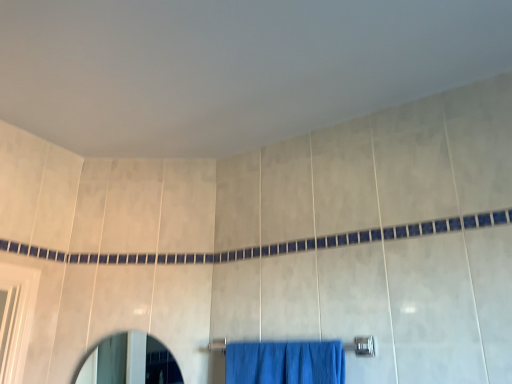
Question: Does matte glass mirror at lower left lie in front of silver metallic towel bar at lower center?

Choices:
 (A) yes
 (B) no

Answer: (B)

Question: Is matte glass mirror at lower left placed right next to silver metallic towel bar at lower center?

Choices:
 (A) no
 (B) yes

Answer: (A)

Question: From the image's perspective, is matte glass mirror at lower left beneath silver metallic towel bar at lower center?

Choices:
 (A) yes
 (B) no

Answer: (A)

Question: Is matte glass mirror at lower left bigger than silver metallic towel bar at lower center?

Choices:
 (A) no
 (B) yes

Answer: (B)

Question: Is matte glass mirror at lower left far away from silver metallic towel bar at lower center?

Choices:
 (A) yes
 (B) no

Answer: (A)

Question: Considering the relative sizes of matte glass mirror at lower left and silver metallic towel bar at lower center in the image provided, is matte glass mirror at lower left thinner than silver metallic towel bar at lower center?

Choices:
 (A) yes
 (B) no

Answer: (A)

Question: Is silver metallic towel bar at lower center positioned far away from matte glass mirror at lower left?

Choices:
 (A) no
 (B) yes

Answer: (B)

Question: Is silver metallic towel bar at lower center at the right side of matte glass mirror at lower left?

Choices:
 (A) yes
 (B) no

Answer: (A)

Question: Does silver metallic towel bar at lower center have a greater width compared to matte glass mirror at lower left?

Choices:
 (A) no
 (B) yes

Answer: (B)

Question: From the image's perspective, is silver metallic towel bar at lower center on matte glass mirror at lower left?

Choices:
 (A) yes
 (B) no

Answer: (A)

Question: Is matte glass mirror at lower left inside silver metallic towel bar at lower center?

Choices:
 (A) yes
 (B) no

Answer: (B)

Question: From a real-world perspective, is silver metallic towel bar at lower center on matte glass mirror at lower left?

Choices:
 (A) yes
 (B) no

Answer: (A)

Question: From their relative heights in the image, would you say matte glass mirror at lower left is taller or shorter than silver metallic towel bar at lower center?

Choices:
 (A) tall
 (B) short

Answer: (A)